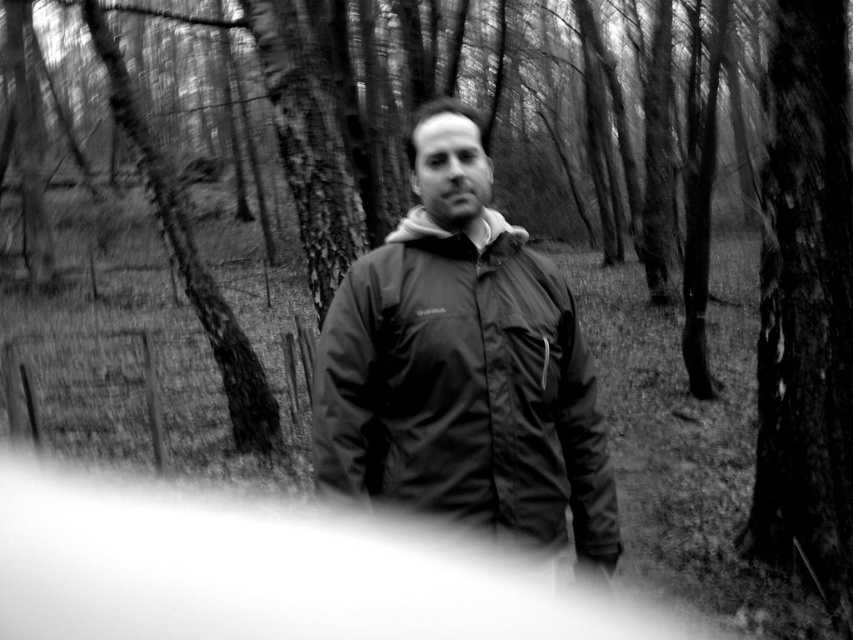
Question: Does matte black jacket at center lie in front of smooth bark tree at right?

Choices:
 (A) yes
 (B) no

Answer: (A)

Question: Does matte black jacket at center have a larger size compared to smooth bark tree at right?

Choices:
 (A) yes
 (B) no

Answer: (B)

Question: Observing the image, what is the correct spatial positioning of matte black jacket at center in reference to smooth bark tree at right?

Choices:
 (A) right
 (B) left

Answer: (B)

Question: Which object appears farthest from the camera in this image?

Choices:
 (A) matte black jacket at center
 (B) smooth bark tree at right

Answer: (B)

Question: Which point appears farthest from the camera in this image?

Choices:
 (A) [328, 474]
 (B) [827, 104]

Answer: (B)